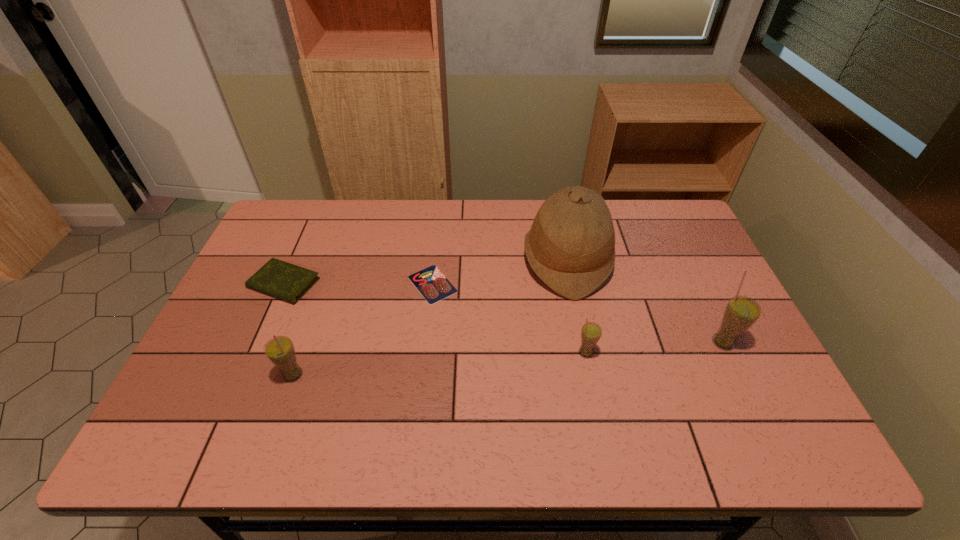
The width and height of the screenshot is (960, 540). I want to click on vacant area that lies between the second shortest object and the second tallest straw for drinking, so click(x=288, y=329).

You are a GUI agent. You are given a task and a screenshot of the screen. Output one action in this format:
    pyautogui.click(x=<x>, y=<y>)
    Task: Click on the free space that is in between the third shortest object and the hat
    
    Given the screenshot: What is the action you would take?
    pyautogui.click(x=576, y=306)

I want to click on free area in between the tallest object and the salami, so click(499, 272).

At what (x,y) coordinates should I click in order to perform the action: click on vacant region between the rightmost object and the shortest straw for drinking. Please return your answer as a coordinate pair (x, y). Looking at the image, I should click on (655, 347).

Locate an element on the screen. This screenshot has height=540, width=960. free space between the nearest straw for drinking and the tallest object is located at coordinates (430, 318).

The height and width of the screenshot is (540, 960). Identify the location of the second closest object to the fifth tallest object. (432, 284).

In order to click on object that stands as the third closest to the diary in this screenshot , I will do `click(571, 245)`.

The height and width of the screenshot is (540, 960). What are the coordinates of `the closest straw for drinking to the diary` in the screenshot? It's located at (280, 350).

Locate which straw for drinking is the second closest to the tallest object. Please provide its 2D coordinates. Your answer should be formatted as a tuple, i.e. [(x, y)], where the tuple contains the x and y coordinates of a point satisfying the conditions above.

[(741, 312)]

Identify the location of free location that satisfies the following two spatial constraints: 1. on the front-facing side of the tallest object; 2. on the front side of the third object from left to right. (571, 284).